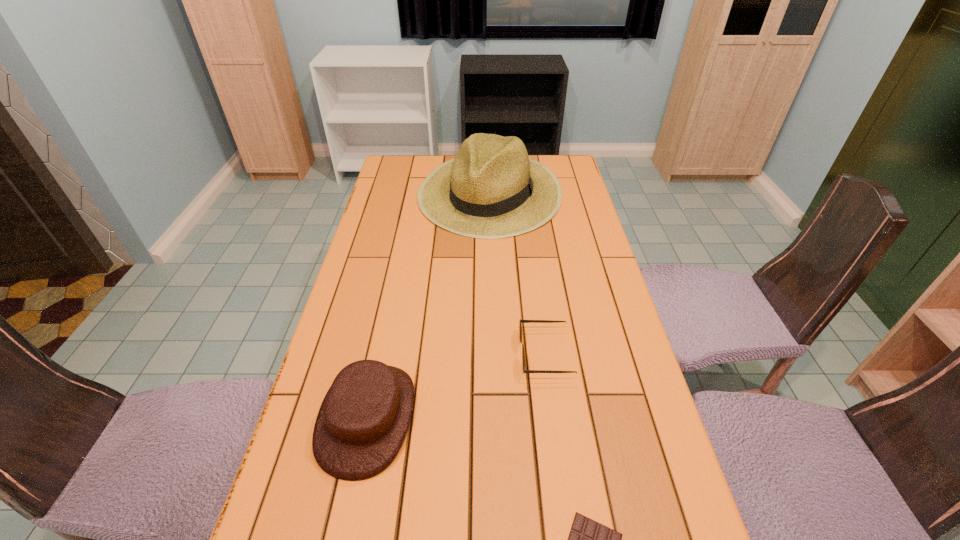
Where is `unoccupied position between the farthest object and the hat`? This screenshot has height=540, width=960. unoccupied position between the farthest object and the hat is located at coordinates [x=429, y=305].

Where is `vacant area that lies between the sunglasses and the sunhat`? Image resolution: width=960 pixels, height=540 pixels. vacant area that lies between the sunglasses and the sunhat is located at coordinates (517, 273).

Locate an element on the screen. free space between the hat and the farthest object is located at coordinates (429, 305).

At what (x,y) coordinates should I click in order to perform the action: click on vacant space that's between the second shortest object and the farthest object. Please return your answer as a coordinate pair (x, y). Looking at the image, I should click on (517, 273).

Where is `the closest object to the shortest object`? the closest object to the shortest object is located at coordinates (363, 420).

Identify which object is the third nearest to the second tallest object. Please provide its 2D coordinates. Your answer should be formatted as a tuple, i.e. [(x, y)], where the tuple contains the x and y coordinates of a point satisfying the conditions above.

[(491, 189)]